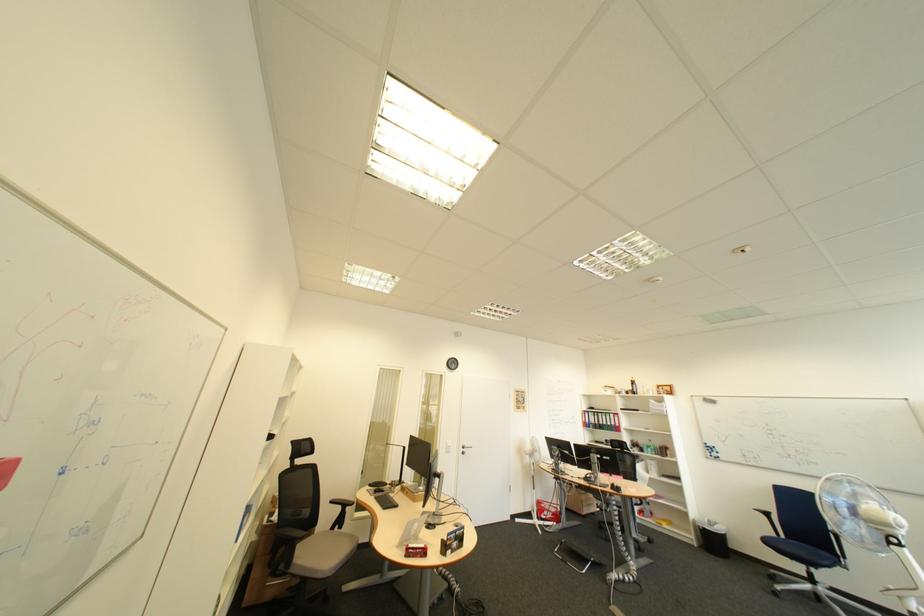
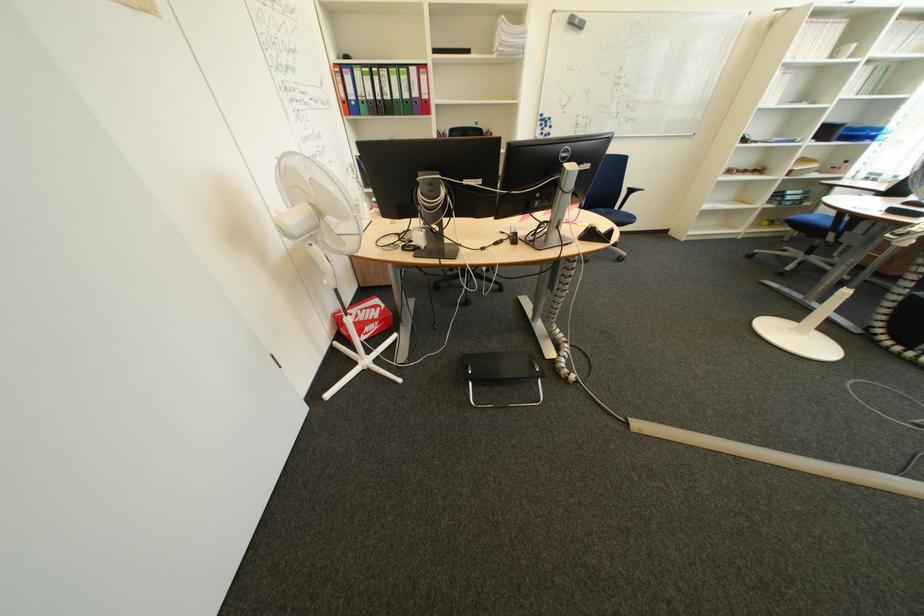
Locate, in the second image, the point that corresponds to point 578,453 in the first image.

(479, 184)